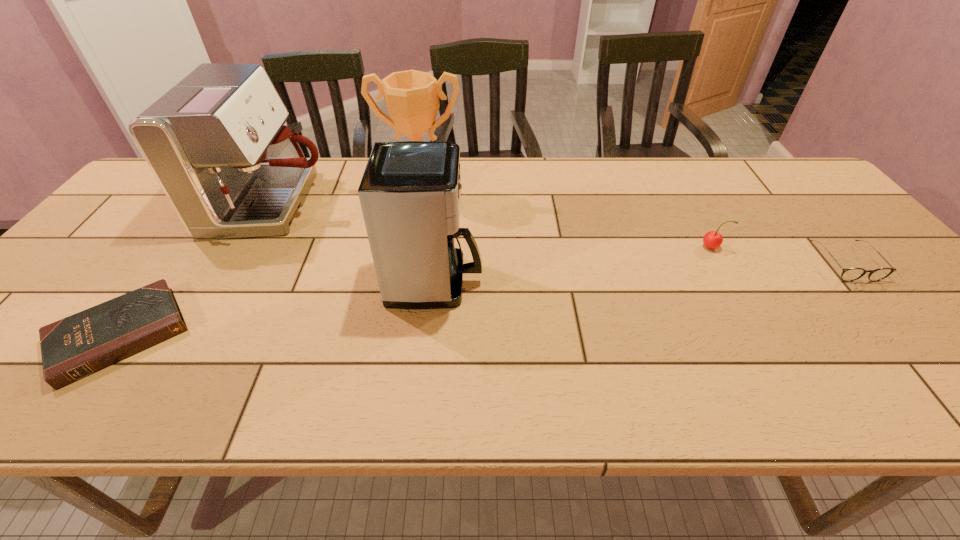
Image resolution: width=960 pixels, height=540 pixels. I want to click on award, so click(x=412, y=97).

Locate an element on the screen. the farther coffee maker is located at coordinates (216, 142).

Identify the location of the nearer coffee maker. (410, 193).

Find the location of `the fifth object from left to right`. the fifth object from left to right is located at coordinates (712, 239).

Where is `cherry`? cherry is located at coordinates (712, 239).

This screenshot has height=540, width=960. I want to click on the rightmost object, so click(848, 274).

The height and width of the screenshot is (540, 960). I want to click on the second shortest object, so click(848, 274).

Where is `the shortest object`? The height and width of the screenshot is (540, 960). the shortest object is located at coordinates (72, 348).

Where is `free point located on the front-facing side of the award`? Image resolution: width=960 pixels, height=540 pixels. free point located on the front-facing side of the award is located at coordinates (404, 303).

The height and width of the screenshot is (540, 960). I want to click on free space located 0.110m on the front of the farther coffee maker near the spout, so click(x=365, y=204).